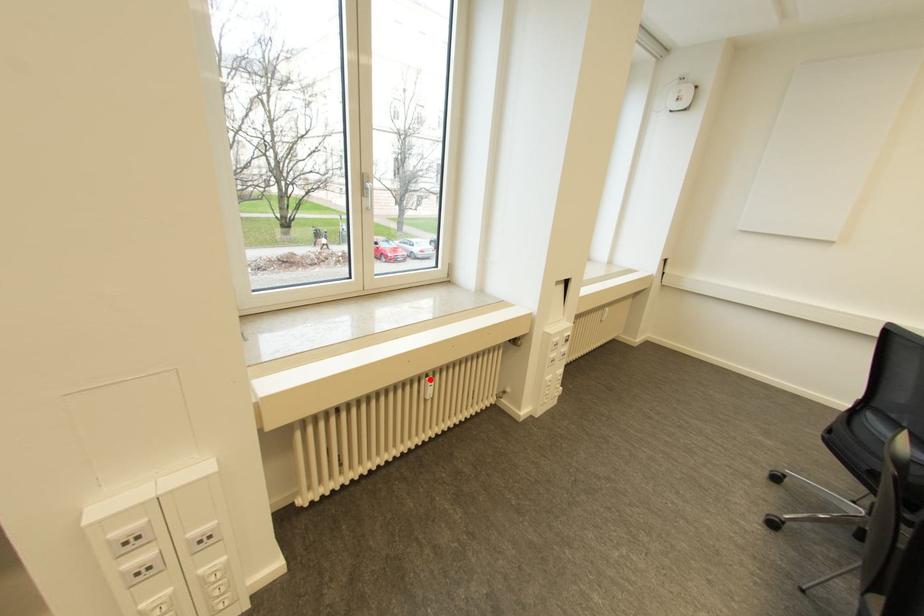
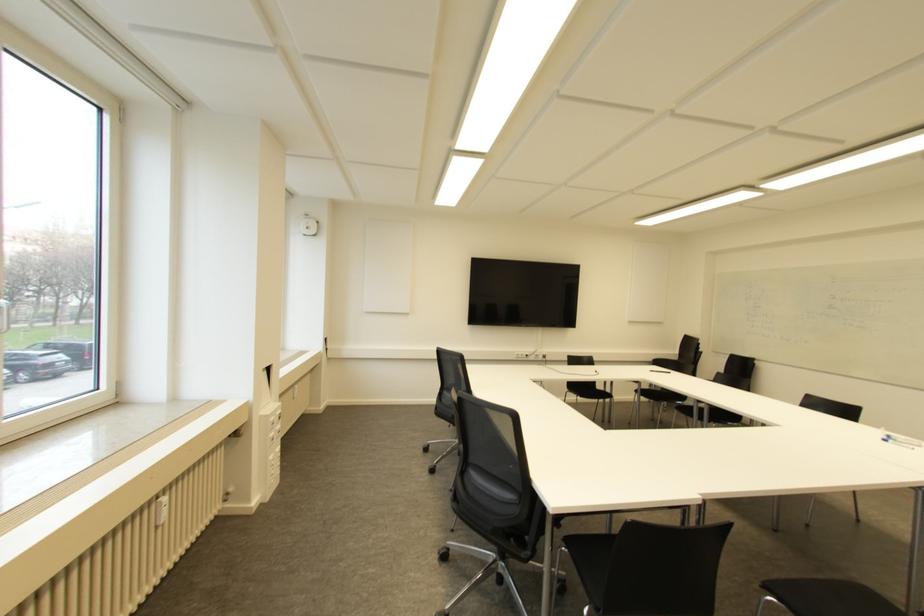
Locate, in the second image, the point that corresponds to the highlighted location in the first image.

(163, 499)